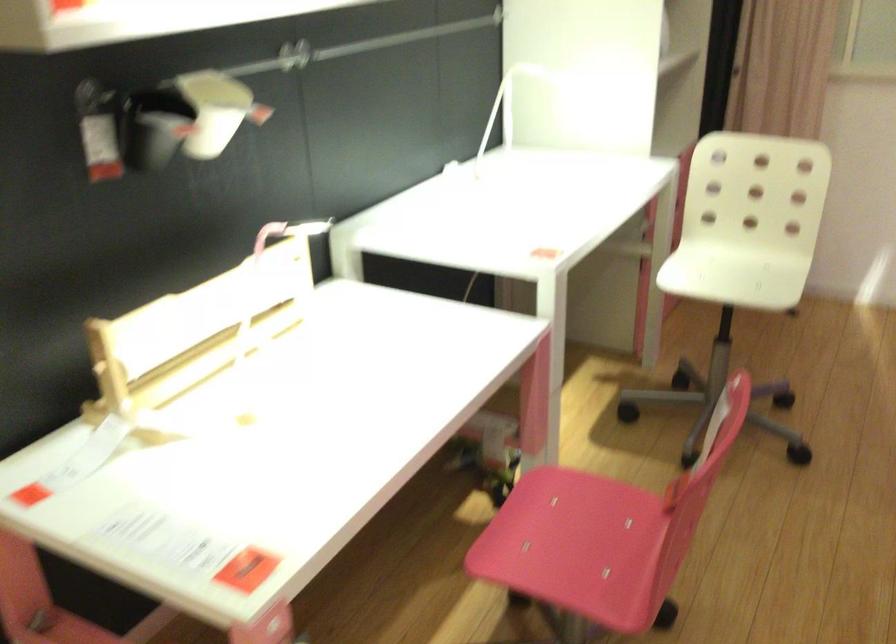
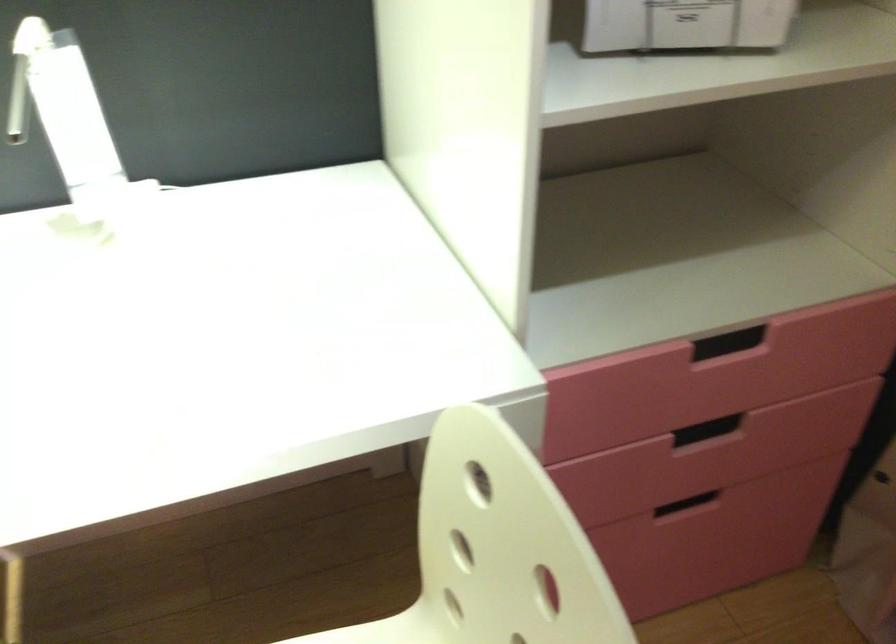
The point at (686, 167) is marked in the first image. Where is the corresponding point in the second image?

(743, 355)